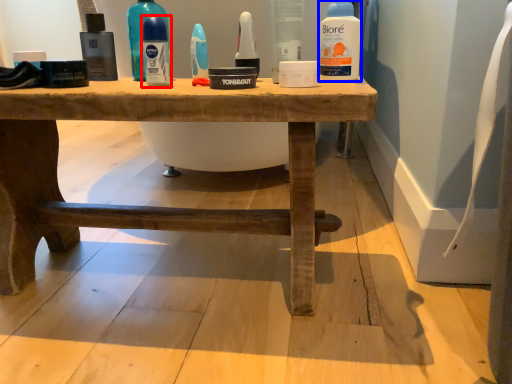
Question: Which point is closer to the camera, mouthwash (highlighted by a red box) or cleaning product (highlighted by a blue box)?

Choices:
 (A) mouthwash
 (B) cleaning product

Answer: (B)